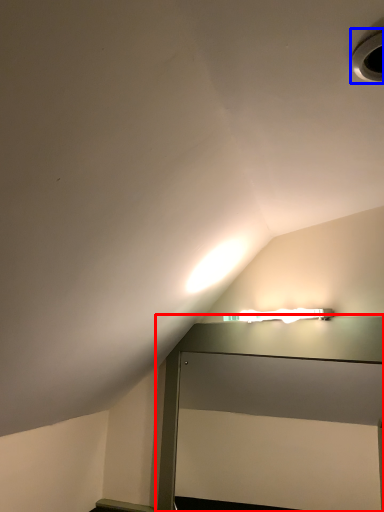
Question: Which point is closer to the camera, table (highlighted by a red box) or hole (highlighted by a blue box)?

Choices:
 (A) table
 (B) hole

Answer: (B)